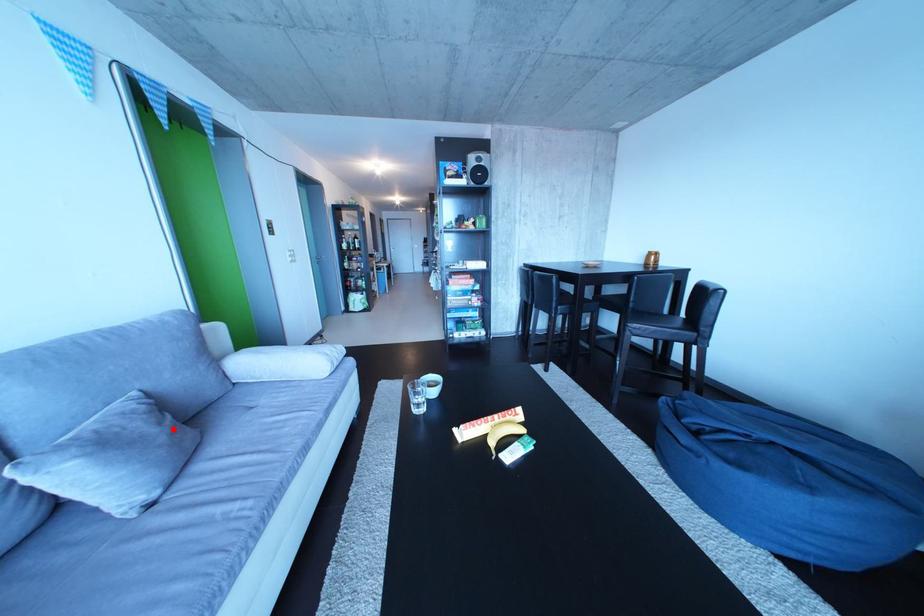
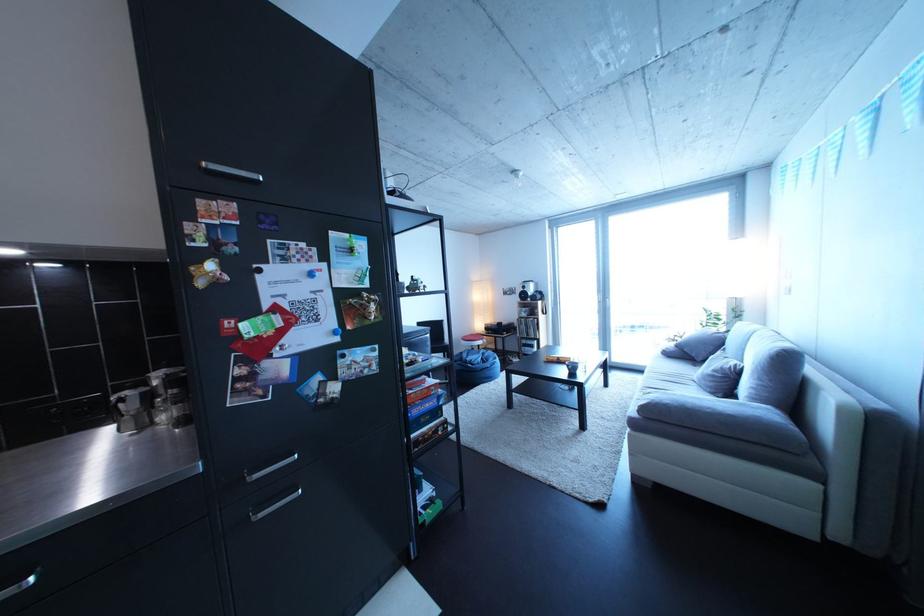
Find the pixel in the second image that matches the highlighted location in the first image.

(727, 377)